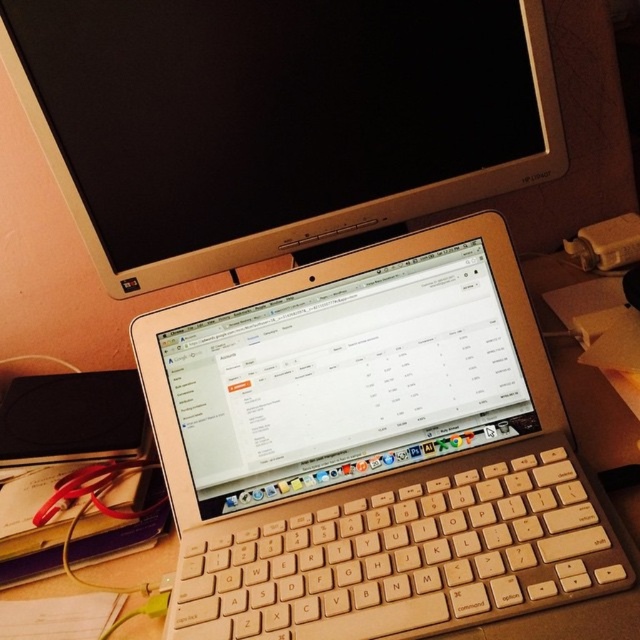
You are a delivery person who needs to place a small package on the desk without moving any items. The package is 16 inches long. Can you fit it horizontally between the silver metallic laptop at center and the edge of the desk?

The distance between the silver metallic laptop at center and the camera is 15.95 inches. Since the package is 16 inches long, it cannot fit horizontally in that space.

You are setting up a new workspace and want to place a large monitor between the silver metallic laptop at center and the beige wood keyboard at center. Considering their sizes, which object should be moved to make space for the monitor?

The beige wood keyboard at center should be moved because the silver metallic laptop at center is larger and would be harder to move, so moving the smaller beige wood keyboard at center would create enough space for the monitor.

You are setting up a new workspace and need to place a 12 inch tall stand between the satin gold monitor at upper center and the beige wood keyboard at center. Is there enough vertical space between them to fit the stand?

The satin gold monitor at upper center is taller than the beige wood keyboard at center, so there is enough vertical space to fit a 12 inch tall stand between them.